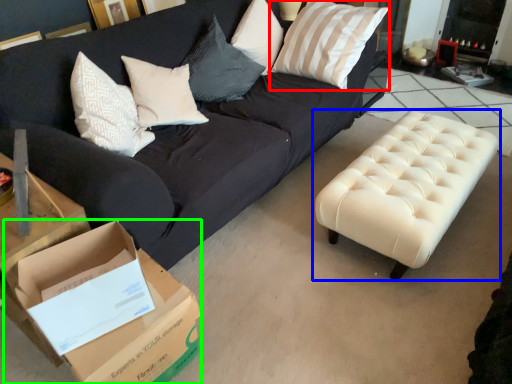
Question: Based on their relative distances, which object is farther from pillow (highlighted by a red box)? Choose from table (highlighted by a blue box) and cardboard box (highlighted by a green box).

Choices:
 (A) table
 (B) cardboard box

Answer: (B)